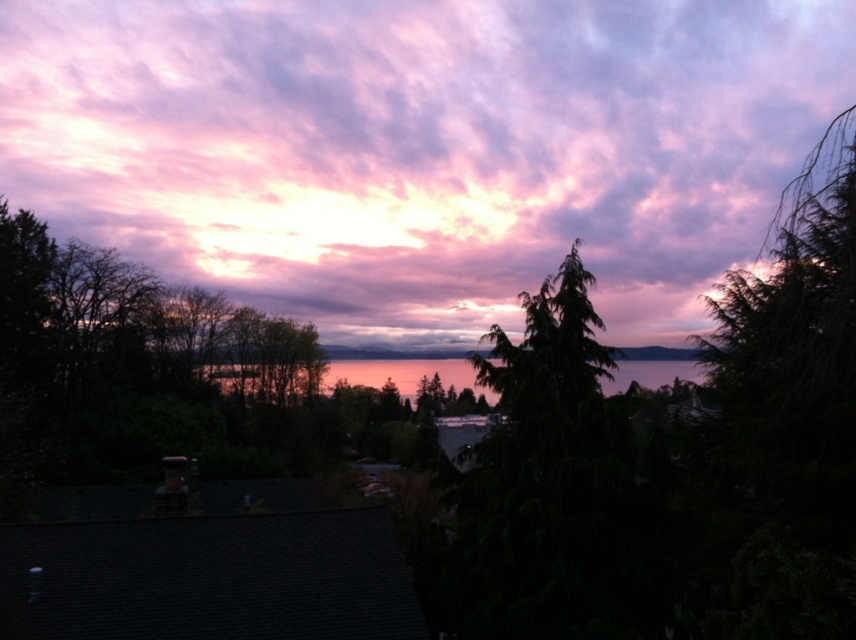
You are an astronomer observing the sunset scene. You notice a pink fluffy cloud at upper center. What are the coordinates of this cloud?

The pink fluffy cloud at upper center is located at coordinates point (421, 147).

You are standing in the sunset scene and want to place a small decorative stone between the two points, point (421, 65) and point (609, 428). Which point should the stone be closer to if you want it to appear closer to the camera?

The stone should be placed closer to point (421, 65) because it is further to the camera than point (609, 428).